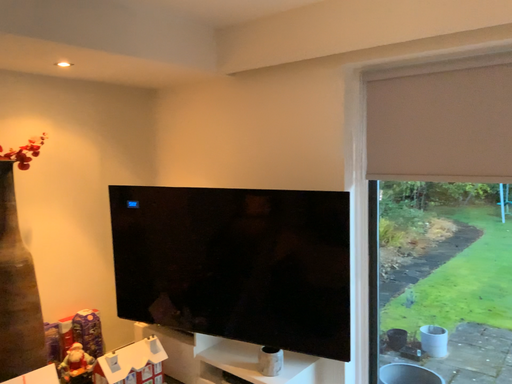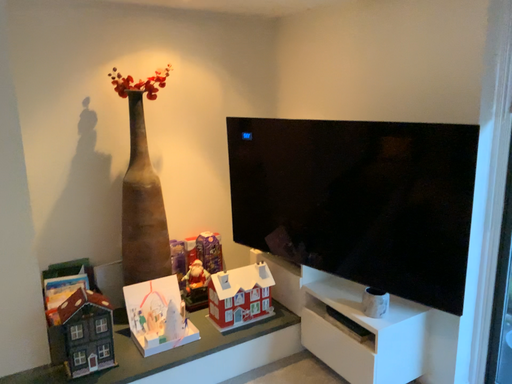
Question: Which way did the camera rotate in the video?

Choices:
 (A) rotated upward
 (B) rotated downward

Answer: (B)